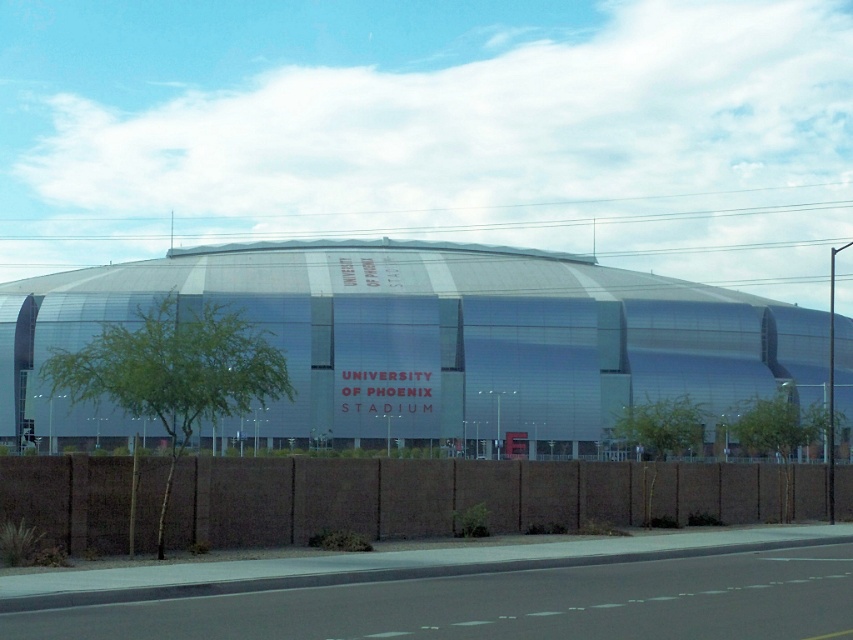
Question: Does metallic silver stadium at center have a larger size compared to brown textured fence at lower center?

Choices:
 (A) yes
 (B) no

Answer: (A)

Question: Can you confirm if metallic silver stadium at center is positioned above brown textured fence at lower center?

Choices:
 (A) yes
 (B) no

Answer: (A)

Question: Which point appears closest to the camera in this image?

Choices:
 (A) (521, 378)
 (B) (381, 524)

Answer: (B)

Question: Can you confirm if metallic silver stadium at center is positioned to the left of brown textured fence at lower center?

Choices:
 (A) yes
 (B) no

Answer: (A)